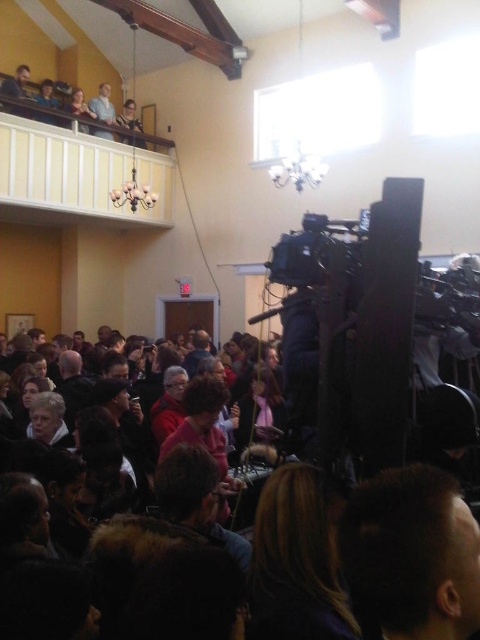
Question: Which object is closer to the camera taking this photo?

Choices:
 (A) white wooden balcony at upper center
 (B) matte plastic face at upper center
 (C) dark brown hair at center
 (D) matte black jacket at upper left

Answer: (C)

Question: Is dark brown hair at lower center to the right of light brown wooden chair at upper center from the viewer's perspective?

Choices:
 (A) no
 (B) yes

Answer: (B)

Question: Which object is farther from the camera taking this photo?

Choices:
 (A) matte black camera at upper center
 (B) light brown wooden chair at upper center
 (C) matte plastic face at upper center

Answer: (B)

Question: Does light brown wooden chair at upper center appear over matte black camera at upper center?

Choices:
 (A) no
 (B) yes

Answer: (B)

Question: Which point is closer to the camera?

Choices:
 (A) dark brown hair at lower center
 (B) matte black camera at upper center
 (C) light brown wooden chair at upper center
 (D) matte plastic face at upper center

Answer: (A)

Question: In this image, where is matte black camera at upper center located relative to matte plastic face at upper center?

Choices:
 (A) above
 (B) below

Answer: (A)